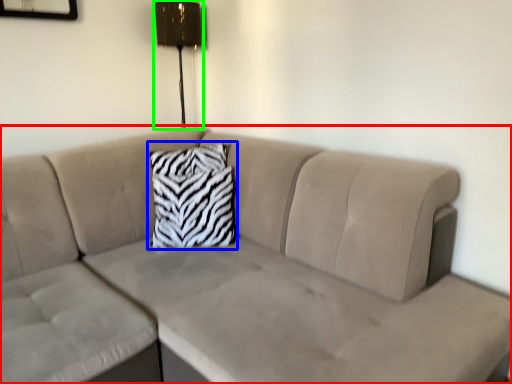
Question: Which object is positioned closest to studio couch (highlighted by a red box)? Select from pillow (highlighted by a blue box) and lamp (highlighted by a green box).

Choices:
 (A) pillow
 (B) lamp

Answer: (A)